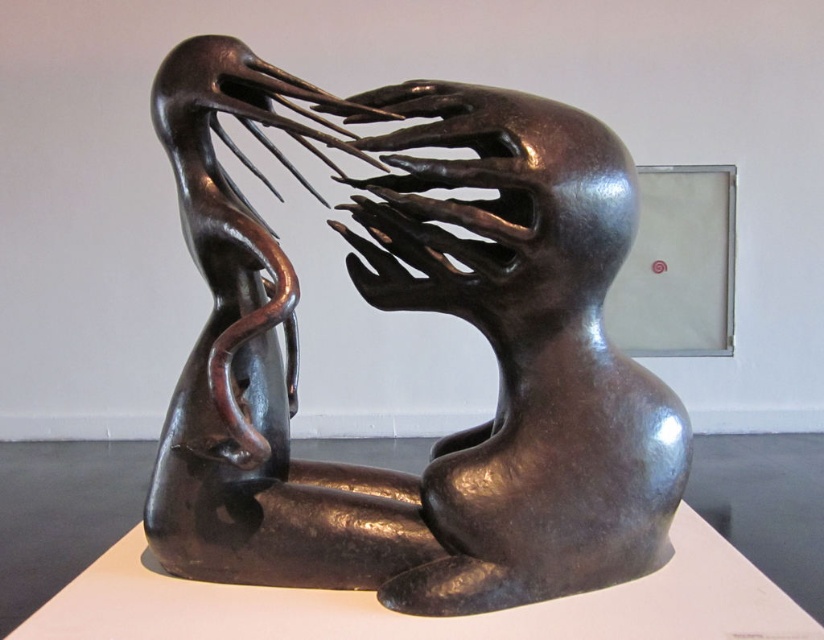
Question: Does shiny bronze sculpture at center have a smaller size compared to shiny metallic head at center?

Choices:
 (A) yes
 (B) no

Answer: (B)

Question: Is shiny bronze sculpture at center to the right of shiny metallic head at center from the viewer's perspective?

Choices:
 (A) no
 (B) yes

Answer: (A)

Question: Which point is closer to the camera?

Choices:
 (A) shiny metallic head at center
 (B) shiny bronze sculpture at center

Answer: (B)

Question: Does shiny bronze sculpture at center have a greater width compared to shiny metallic head at center?

Choices:
 (A) yes
 (B) no

Answer: (A)

Question: Which point is farther to the camera?

Choices:
 (A) shiny metallic head at center
 (B) shiny bronze sculpture at center

Answer: (A)

Question: Which point is closer to the camera?

Choices:
 (A) (590, 163)
 (B) (222, 209)

Answer: (A)